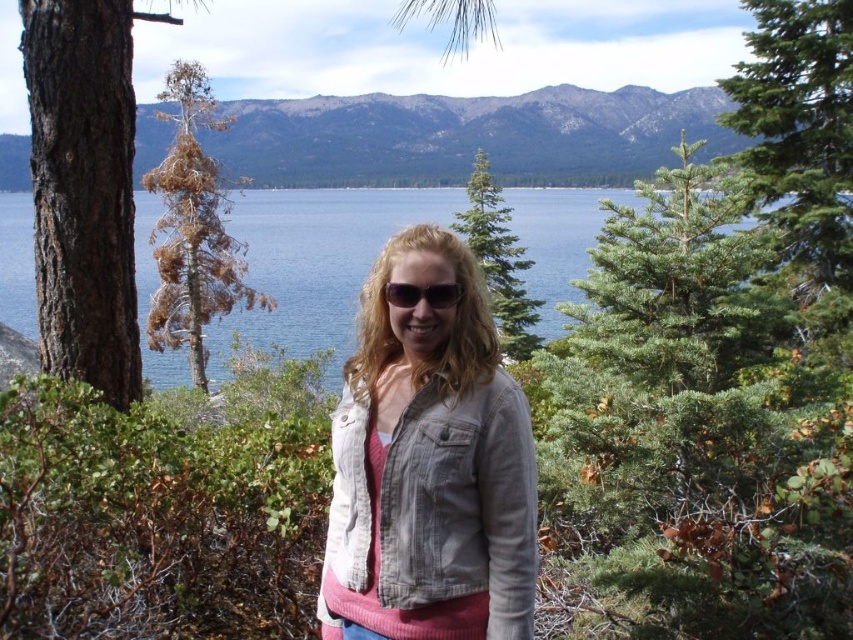
You are a nature photographer trying to capture a clear shot of the dark brown rough bark at left and the green textured pine tree at center. Based on their positions, which object is closer to the camera?

The dark brown rough bark at left is closer to the camera because it is positioned below the green textured pine tree at center, indicating it is in the foreground.